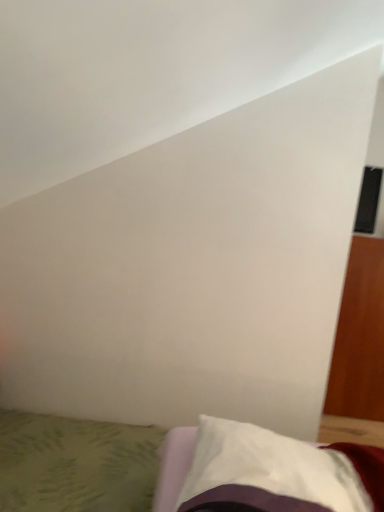
Where is `white soft pillow at lower right`? white soft pillow at lower right is located at coordinates (278, 472).

What do you see at coordinates (278, 472) in the screenshot? I see `white soft pillow at lower right` at bounding box center [278, 472].

What do you see at coordinates (76, 464) in the screenshot? This screenshot has width=384, height=512. I see `white fabric bed at lower center` at bounding box center [76, 464].

Measure the distance between white fabric bed at lower center and camera.

white fabric bed at lower center and camera are 3.43 feet apart from each other.

Where is `white fabric bed at lower center`? The width and height of the screenshot is (384, 512). white fabric bed at lower center is located at coordinates (76, 464).

At what (x,y) coordinates should I click in order to perform the action: click on white soft pillow at lower right. Please return your answer as a coordinate pair (x, y). The width and height of the screenshot is (384, 512). Looking at the image, I should click on (278, 472).

Which object is positioned more to the left, white soft pillow at lower right or white fabric bed at lower center?

white fabric bed at lower center is more to the left.

Is white soft pillow at lower right further to camera compared to white fabric bed at lower center?

No, white soft pillow at lower right is in front of white fabric bed at lower center.

Considering the positions of point (313, 480) and point (138, 490), is point (313, 480) closer or farther from the camera than point (138, 490)?

Point (313, 480).

From the image's perspective, does white soft pillow at lower right appear higher than white fabric bed at lower center?

Indeed, from the image's perspective, white soft pillow at lower right is shown above white fabric bed at lower center.

From a real-world perspective, is white soft pillow at lower right located beneath white fabric bed at lower center?

Incorrect, from a real-world perspective, white soft pillow at lower right is higher than white fabric bed at lower center.

Considering the sizes of white soft pillow at lower right and white fabric bed at lower center in the image, is white soft pillow at lower right wider or thinner than white fabric bed at lower center?

white soft pillow at lower right is thinner than white fabric bed at lower center.

Between white soft pillow at lower right and white fabric bed at lower center, which one has more height?

With more height is white soft pillow at lower right.

Can you confirm if white soft pillow at lower right is bigger than white fabric bed at lower center?

No, white soft pillow at lower right is not bigger than white fabric bed at lower center.

Would you say white soft pillow at lower right is inside or outside white fabric bed at lower center?

white soft pillow at lower right is outside white fabric bed at lower center.

In the scene shown: Is white soft pillow at lower right with white fabric bed at lower center?

No, white soft pillow at lower right is not making contact with white fabric bed at lower center.

Is white soft pillow at lower right turned away from white fabric bed at lower center?

No, white soft pillow at lower right is not facing the opposite direction of white fabric bed at lower center.

At what (x,y) coordinates should I click in order to perform the action: click on pillow located above the white fabric bed at lower center (from a real-world perspective). Please return your answer as a coordinate pair (x, y). Image resolution: width=384 pixels, height=512 pixels. Looking at the image, I should click on (278, 472).

Which is more to the left, white fabric bed at lower center or white soft pillow at lower right?

Positioned to the left is white fabric bed at lower center.

Who is more distant, white fabric bed at lower center or white soft pillow at lower right?

white fabric bed at lower center is further away from the camera.

Which point is more forward, (x=131, y=484) or (x=271, y=505)?

The point (x=271, y=505) is more forward.

From the image's perspective, between white fabric bed at lower center and white soft pillow at lower right, who is located below?

From the image's view, white fabric bed at lower center is below.

From a real-world perspective, is white fabric bed at lower center located higher than white soft pillow at lower right?

No.

Which of these two, white fabric bed at lower center or white soft pillow at lower right, is thinner?

Thinner between the two is white soft pillow at lower right.

Is white fabric bed at lower center shorter than white soft pillow at lower right?

Yes.

In the scene shown: Which of these two, white fabric bed at lower center or white soft pillow at lower right, is smaller?

Smaller between the two is white soft pillow at lower right.

Which is correct: white fabric bed at lower center is inside white soft pillow at lower right, or outside of it?

white fabric bed at lower center is outside white soft pillow at lower right.

Consider the image. Is white fabric bed at lower center with white soft pillow at lower right?

No, white fabric bed at lower center is not next to white soft pillow at lower right.

Is white fabric bed at lower center aimed at white soft pillow at lower right?

No, white fabric bed at lower center is not turned towards white soft pillow at lower right.

How many degrees apart are the facing directions of white fabric bed at lower center and white soft pillow at lower right?

The angular difference between white fabric bed at lower center and white soft pillow at lower right is 169 degrees.

Measure the distance between white fabric bed at lower center and white soft pillow at lower right.

white fabric bed at lower center is 18.91 inches away from white soft pillow at lower right.

The image size is (384, 512). Identify the location of pillow that appears above the white fabric bed at lower center (from a real-world perspective). pyautogui.click(x=278, y=472).

The image size is (384, 512). What are the coordinates of `pillow that is in front of the white fabric bed at lower center` in the screenshot? It's located at (278, 472).

There is a white fabric bed at lower center. At what (x,y) coordinates should I click in order to perform the action: click on pillow above it (from a real-world perspective). Please return your answer as a coordinate pair (x, y). The width and height of the screenshot is (384, 512). Looking at the image, I should click on (278, 472).